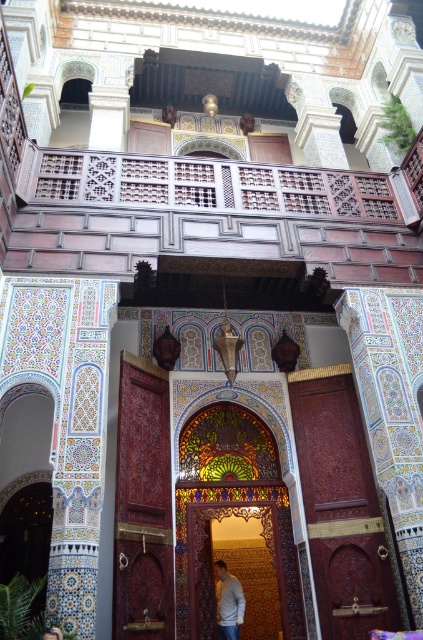
Question: Can you confirm if carved wood door at center is positioned below light gray sweater at center?

Choices:
 (A) yes
 (B) no

Answer: (B)

Question: Among these points, which one is farthest from the camera?

Choices:
 (A) (209, 516)
 (B) (46, 634)
 (C) (220, 582)

Answer: (C)

Question: Does light gray sweater at center appear over light brown hair at center?

Choices:
 (A) no
 (B) yes

Answer: (A)

Question: Based on their relative distances, which object is farther from the light brown hair at center?

Choices:
 (A) carved wood door at center
 (B) light gray sweater at center

Answer: (B)

Question: Which of the following is the closest to the observer?

Choices:
 (A) carved wood door at center
 (B) light gray sweater at center
 (C) light brown hair at center

Answer: (C)

Question: Is carved wood door at center below light gray sweater at center?

Choices:
 (A) no
 (B) yes

Answer: (A)